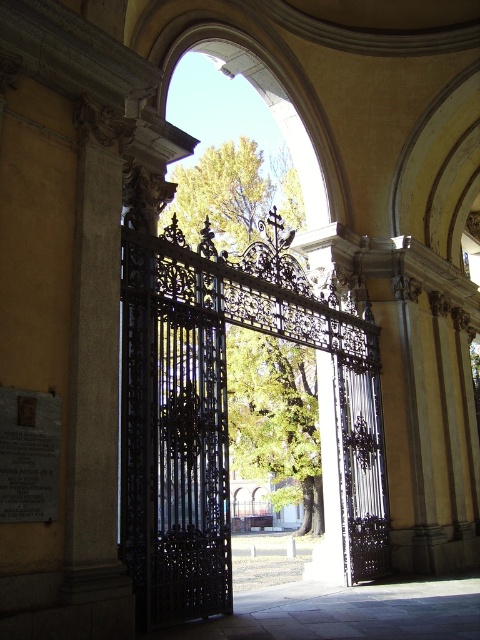
You are a delivery person with a cart that is 10 feet wide. You need to pass through the pathway between the black wrought iron gate at center and the smooth stone pillar at left. Can your cart fit through the space between them?

The black wrought iron gate at center and smooth stone pillar at left are 33.12 feet apart, so yes, the cart can fit through the space between them since the distance is wider than the cart.

You are standing at the entrance of the grand structure and see two points marked on the ground. The first point is at coordinates point (307, 342) and the second is at point (115, 376). If you want to walk towards the sunlit area beyond the open gate, which point should you step on first?

You should step on point (115, 376) first because it is in front of point (307, 342). Since the gate is open towards the sunlit area, moving towards the closer point would lead you forward in that direction.

You are a delivery person trying to enter through the black wrought iron gate at center. The gate requires a clearance of 2 meters to pass through. Can you determine if the gate is tall enough based on its size compared to the smooth stone pillar at left?

The black wrought iron gate at center has a larger size compared to the smooth stone pillar at left. Since the gate is larger and the pillar is part of the grand architectural structure, it is likely that the gate meets or exceeds the 2 meter clearance requirement. Therefore, the black wrought iron gate at center should allow passage for the delivery person.